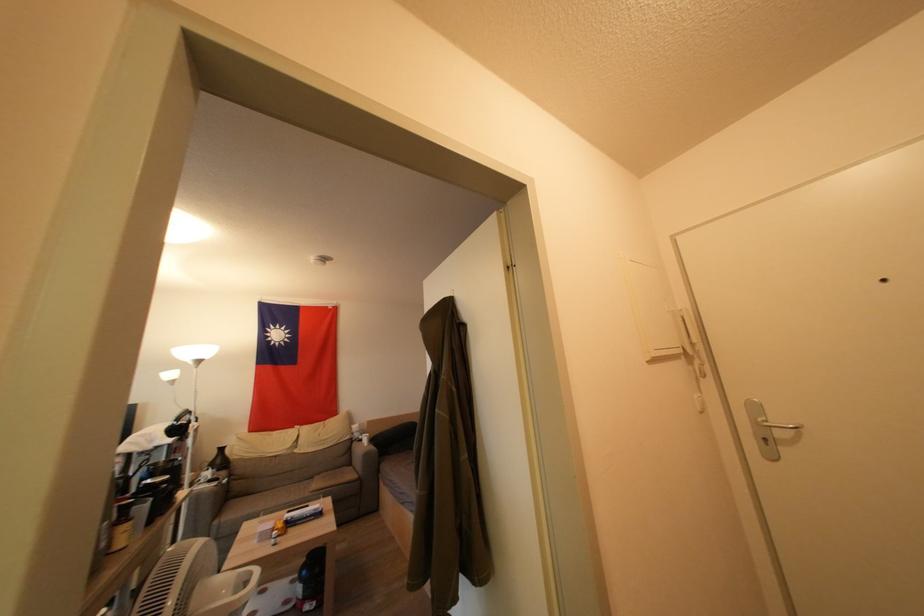
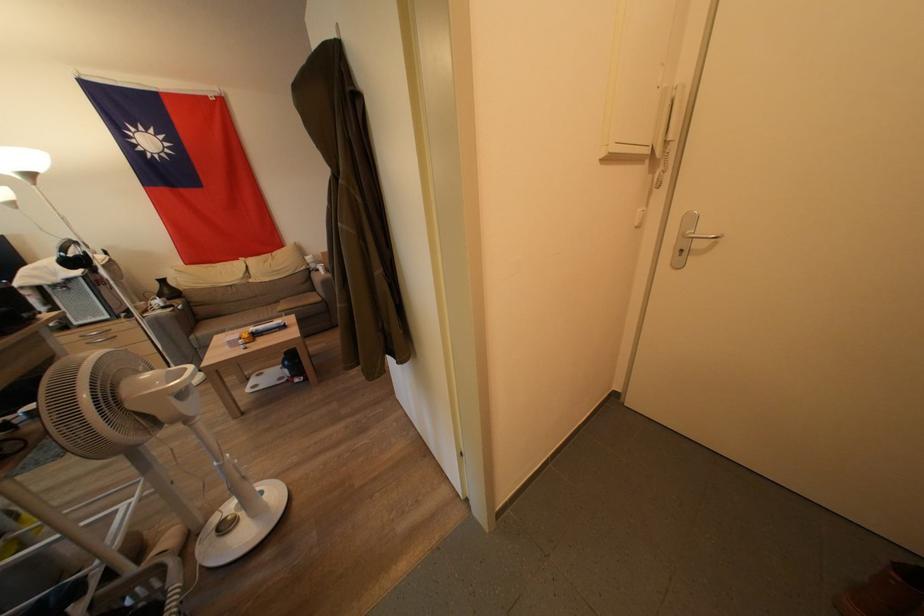
Where in the second image is the point corresponding to [359,448] from the first image?

(319, 278)